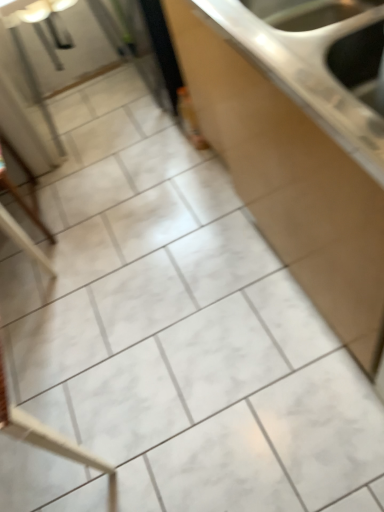
This screenshot has height=512, width=384. Find the location of `free space to the right of wooden chair at left`. free space to the right of wooden chair at left is located at coordinates (90, 193).